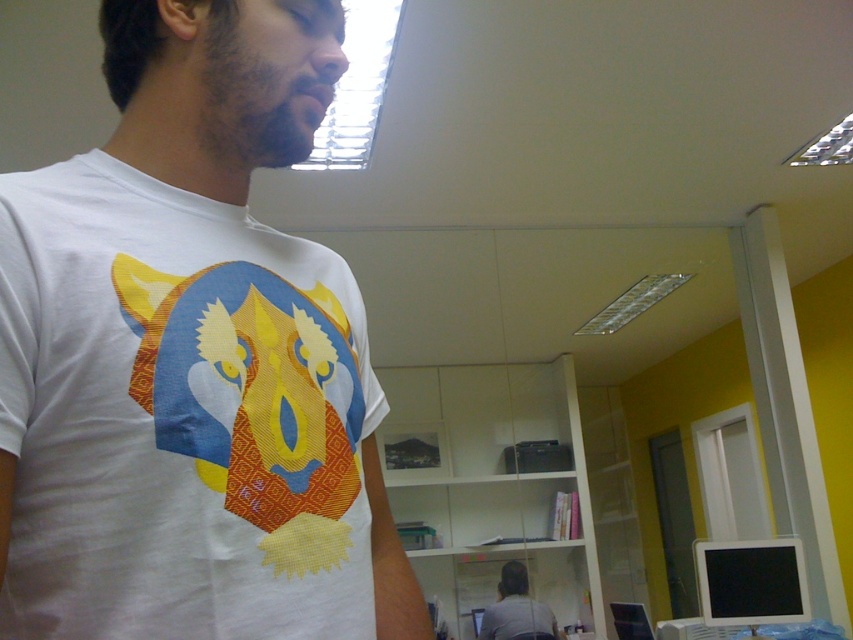
You are an AI assistant analyzing the image. The scene shows a person in an office setting. There is a point labeled at coordinates (190, 358). What object is located at that point?

The point at coordinates (190, 358) indicates the white matte tshirt at center.

You are a delivery robot with a height of 24 inches. You need to deliver a package to the point marked by the coordinates point (231,570). The camera is positioned at your current location. Can you reach the delivery point without hitting your head?

The distance between point (231,570) and the camera is 23.40 inches. Since your robot is 24 inches tall, you are 0.6 inches taller than the available height, so you might hit your head if you proceed. Consider lowering the robot or finding an alternative path.